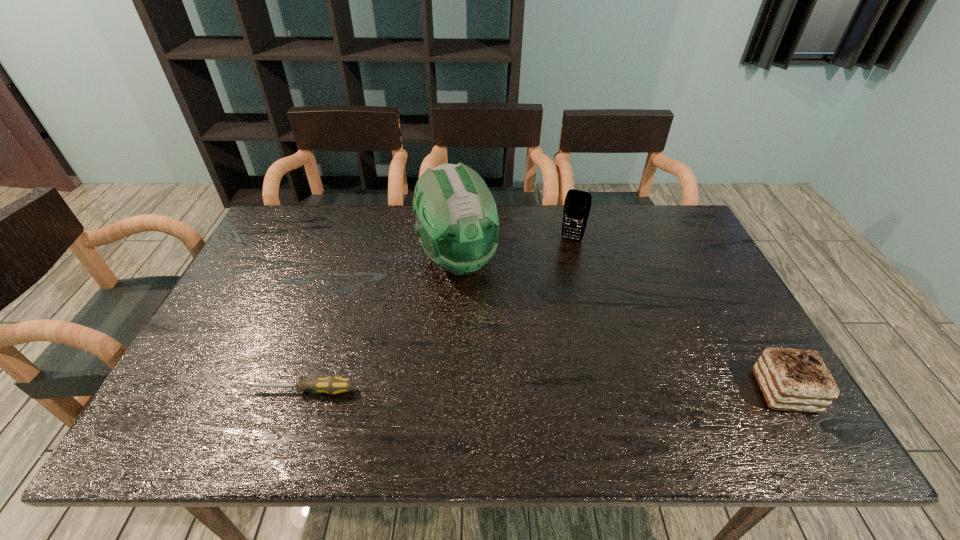
This screenshot has height=540, width=960. I want to click on vacant space located 0.130m at the tip of the leftmost object, so click(x=194, y=390).

Identify the location of vacant space positioned 0.170m on the back of the chocolate cake. (741, 316).

In order to click on free location located on the screen of the cellular telephone in this screenshot , I will do `click(540, 313)`.

Locate an element on the screen. vacant space located on the screen of the cellular telephone is located at coordinates (539, 319).

Image resolution: width=960 pixels, height=540 pixels. Find the location of `vacant space located 0.360m on the screen of the cellular telephone`. vacant space located 0.360m on the screen of the cellular telephone is located at coordinates point(537,324).

Find the location of a particular element. vacant space located on the visor of the football helmet is located at coordinates (505, 361).

Locate an element on the screen. This screenshot has width=960, height=540. free location located on the visor of the football helmet is located at coordinates (488, 326).

This screenshot has height=540, width=960. In order to click on vacant space located 0.220m on the visor of the football helmet in this screenshot , I will do `click(499, 349)`.

Where is `cellular telephone that is at the far edge`? cellular telephone that is at the far edge is located at coordinates coord(577,204).

The image size is (960, 540). I want to click on football helmet present at the far edge, so pos(457,222).